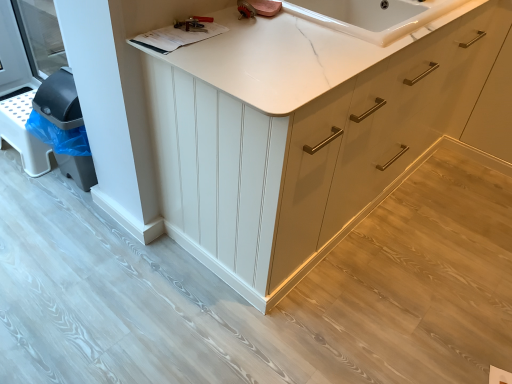
The height and width of the screenshot is (384, 512). I want to click on free location to the right of metallic silver wrench at upper center, so click(238, 23).